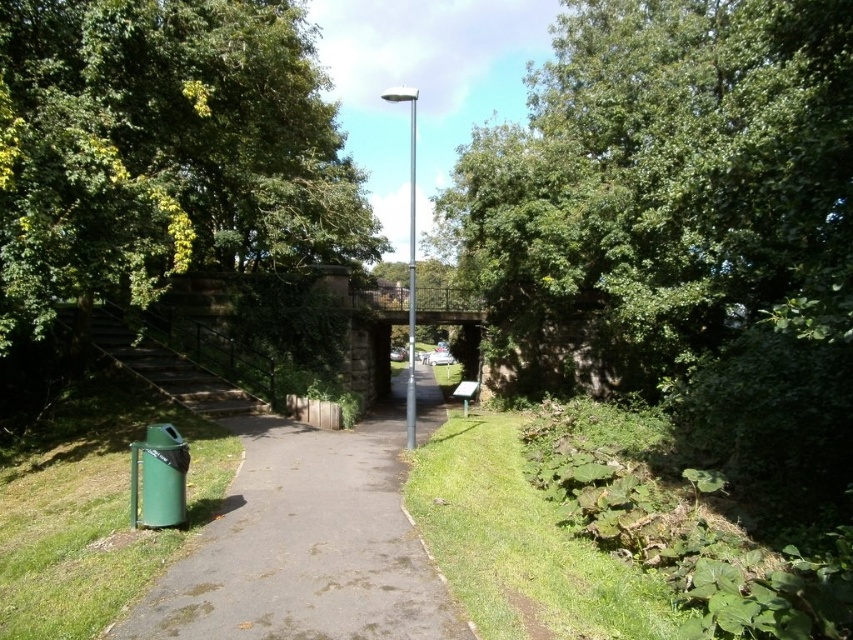
Question: Where is green leafy tree at upper center located in relation to green leafy tree at upper left in the image?

Choices:
 (A) left
 (B) right

Answer: (B)

Question: From the image, what is the correct spatial relationship of green leafy tree at upper left in relation to green asphalt pavement at lower left?

Choices:
 (A) right
 (B) left

Answer: (B)

Question: Estimate the real-world distances between objects in this image. Which object is farther from the metallic pole at center?

Choices:
 (A) green leafy tree at upper left
 (B) green leafy tree at upper center
 (C) green asphalt pavement at lower left

Answer: (C)

Question: Which point is farther to the camera?

Choices:
 (A) (758, 3)
 (B) (207, 605)

Answer: (A)

Question: Among these objects, which one is farthest from the camera?

Choices:
 (A) green asphalt pavement at lower left
 (B) metallic pole at center
 (C) green leafy tree at upper center
 (D) green leafy tree at upper left

Answer: (B)

Question: Can you confirm if green leafy tree at upper left is positioned to the left of metallic pole at center?

Choices:
 (A) yes
 (B) no

Answer: (A)